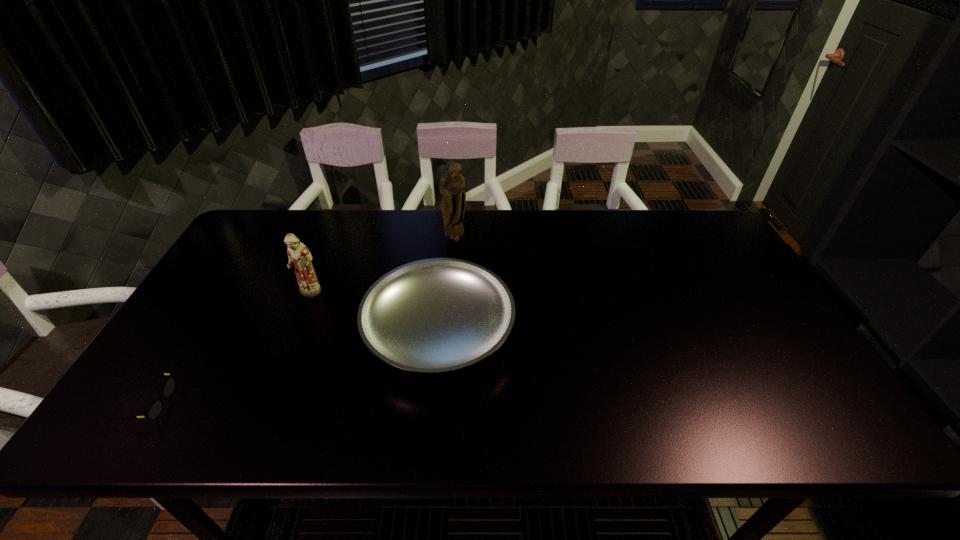
This screenshot has height=540, width=960. Identify the location of vacant area situated 0.280m on the front-facing side of the leftmost object. (290, 403).

I want to click on object that is at the far edge, so click(x=452, y=184).

Where is `object located at the near edge`? This screenshot has height=540, width=960. object located at the near edge is located at coordinates (x=154, y=410).

Where is `object that is at the left edge`? object that is at the left edge is located at coordinates (154, 410).

The image size is (960, 540). Find the location of `object that is at the near left corner`. object that is at the near left corner is located at coordinates (154, 410).

Find the location of `blank space at the far edge of the desktop`. blank space at the far edge of the desktop is located at coordinates (496, 221).

At what (x,y) coordinates should I click in order to perform the action: click on vacant space at the near edge of the desktop. Please return your answer as a coordinate pair (x, y). Looking at the image, I should click on (646, 419).

Identify the location of vacant space at the left edge. point(199,372).

In the image, there is a desktop. What are the coordinates of `free space at the right edge` in the screenshot? It's located at (780, 350).

In the image, there is a desktop. Find the location of `vacant space at the far right corner`. vacant space at the far right corner is located at coordinates coord(704,229).